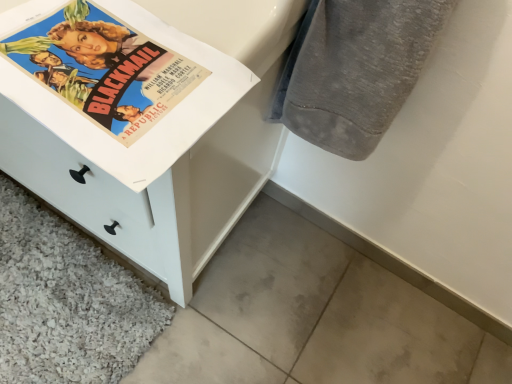
Question: Is gray cotton towel at upper right further to camera compared to white matte chest of drawers at left?

Choices:
 (A) yes
 (B) no

Answer: (A)

Question: From the image's perspective, is gray cotton towel at upper right above white matte chest of drawers at left?

Choices:
 (A) no
 (B) yes

Answer: (A)

Question: From the image's perspective, is gray cotton towel at upper right beneath white matte chest of drawers at left?

Choices:
 (A) no
 (B) yes

Answer: (B)

Question: Is gray cotton towel at upper right looking in the opposite direction of white matte chest of drawers at left?

Choices:
 (A) no
 (B) yes

Answer: (A)

Question: Is gray cotton towel at upper right thinner than white matte chest of drawers at left?

Choices:
 (A) no
 (B) yes

Answer: (B)

Question: Does gray cotton towel at upper right have a smaller size compared to white matte chest of drawers at left?

Choices:
 (A) yes
 (B) no

Answer: (A)

Question: Does white matte chest of drawers at left come behind gray cotton towel at upper right?

Choices:
 (A) no
 (B) yes

Answer: (A)

Question: Does white matte chest of drawers at left lie in front of gray cotton towel at upper right?

Choices:
 (A) no
 (B) yes

Answer: (B)

Question: Is white matte chest of drawers at left touching gray cotton towel at upper right?

Choices:
 (A) no
 (B) yes

Answer: (A)

Question: Is white matte chest of drawers at left far from gray cotton towel at upper right?

Choices:
 (A) yes
 (B) no

Answer: (B)

Question: Does white matte chest of drawers at left have a smaller size compared to gray cotton towel at upper right?

Choices:
 (A) no
 (B) yes

Answer: (A)

Question: Is white matte chest of drawers at left thinner than gray cotton towel at upper right?

Choices:
 (A) yes
 (B) no

Answer: (B)

Question: Is gray cotton towel at upper right bigger or smaller than white matte chest of drawers at left?

Choices:
 (A) small
 (B) big

Answer: (A)